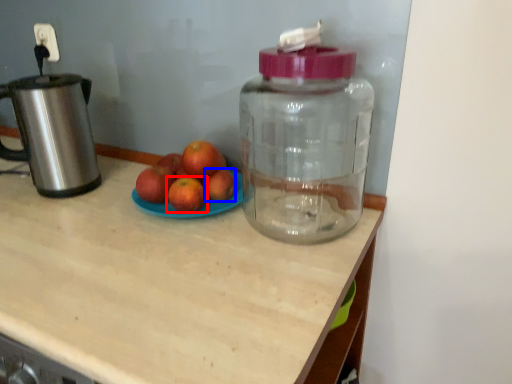
Question: Which of the following is the closest to the observer, grapefruit (highlighted by a red box) or apple (highlighted by a blue box)?

Choices:
 (A) grapefruit
 (B) apple

Answer: (A)